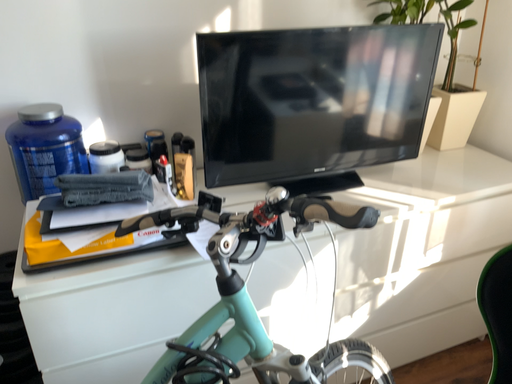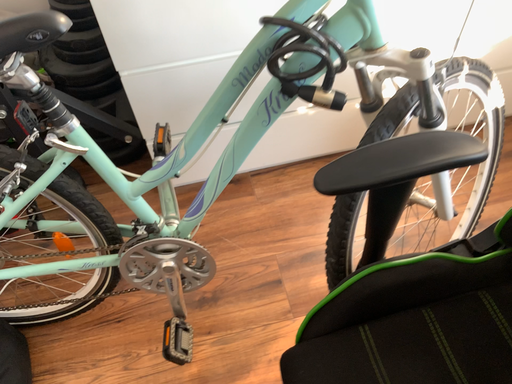
Question: Which way did the camera rotate in the video?

Choices:
 (A) rotated upward
 (B) rotated downward

Answer: (B)